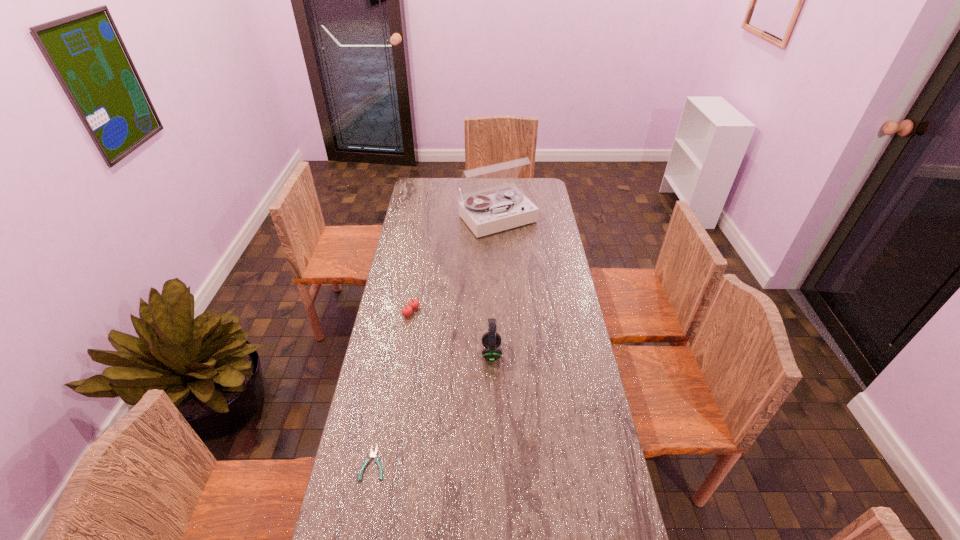
Where is `the tallest object`? The image size is (960, 540). the tallest object is located at coordinates (484, 214).

I want to click on record player, so click(x=484, y=214).

Locate an element on the screen. headset is located at coordinates (491, 340).

Locate an element on the screen. the third shortest object is located at coordinates (491, 340).

You are a GUI agent. You are given a task and a screenshot of the screen. Output one action in this format:
    pyautogui.click(x=<x>, y=<y>)
    Task: Click on the cherry
    The width and height of the screenshot is (960, 540).
    Given the screenshot: What is the action you would take?
    pyautogui.click(x=414, y=303)

This screenshot has width=960, height=540. Find the location of `the second farthest object`. the second farthest object is located at coordinates (414, 303).

Find the location of `the nearest object`. the nearest object is located at coordinates (372, 454).

Where is `pliers`? pliers is located at coordinates (372, 454).

Locate an element on the screen. Image resolution: width=960 pixels, height=540 pixels. vacant point located 0.080m on the back of the tallest object is located at coordinates (495, 191).

Image resolution: width=960 pixels, height=540 pixels. Find the location of `blank area located on the ear cups of the third shortest object`. blank area located on the ear cups of the third shortest object is located at coordinates (466, 353).